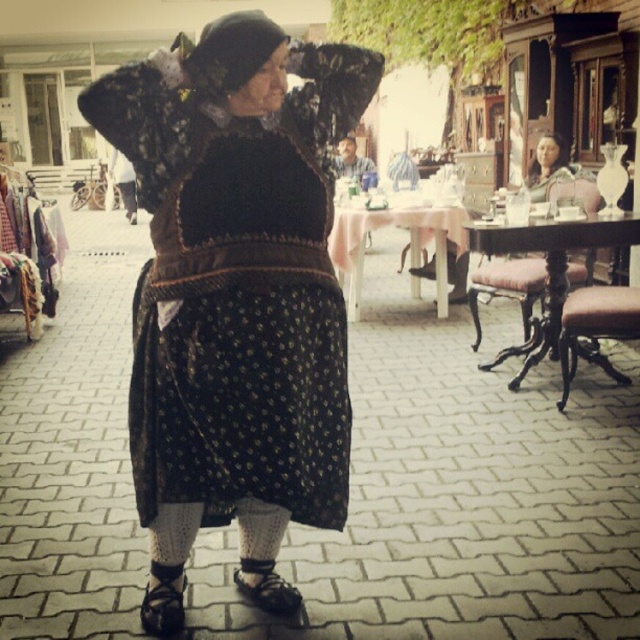
You are a photographer setting up a shoot in this outdoor area. You need to ensure that the black textured dress at center and the brown leather stool at lower right are both visible in the frame. Considering their heights, which object will appear larger in the photo?

The black textured dress at center is taller than the brown leather stool at lower right, so it will appear larger in the photo.

You are a photographer setting up a shoot in this outdoor area. You have a client wearing the black textured dress at center and need to position them relative to the brown leather stool at lower right. According to the scene, where should the dress be placed in relation to the stool?

The black textured dress at center should be placed above the brown leather stool at lower right as per the scene description.